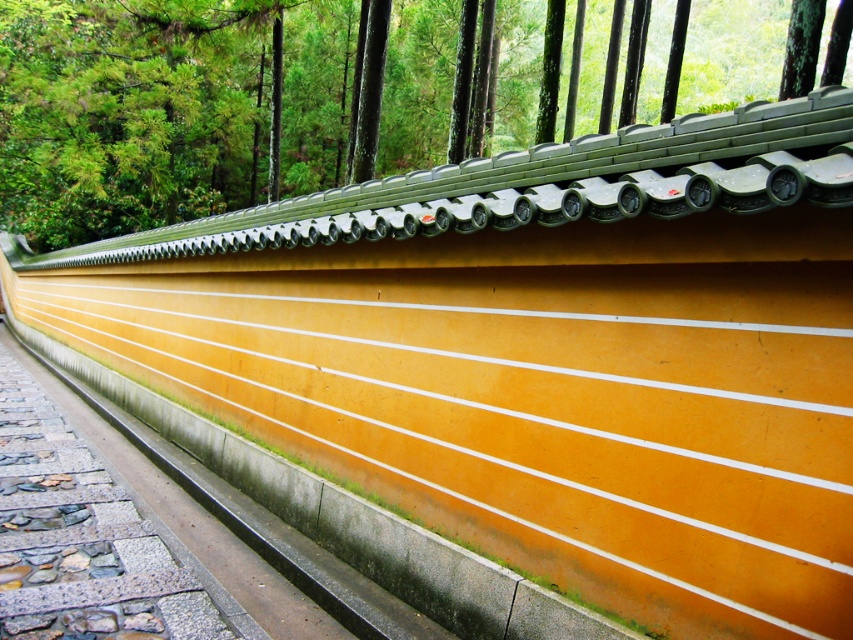
Is green matte roof tiles at upper center above smooth stone path at lower left?

Yes.

Does green matte roof tiles at upper center lie in front of smooth stone path at lower left?

No.

Which is in front, point (642, 108) or point (114, 433)?

Point (114, 433)

In order to click on green matte roof tiles at upper center in this screenshot , I will do `click(129, 113)`.